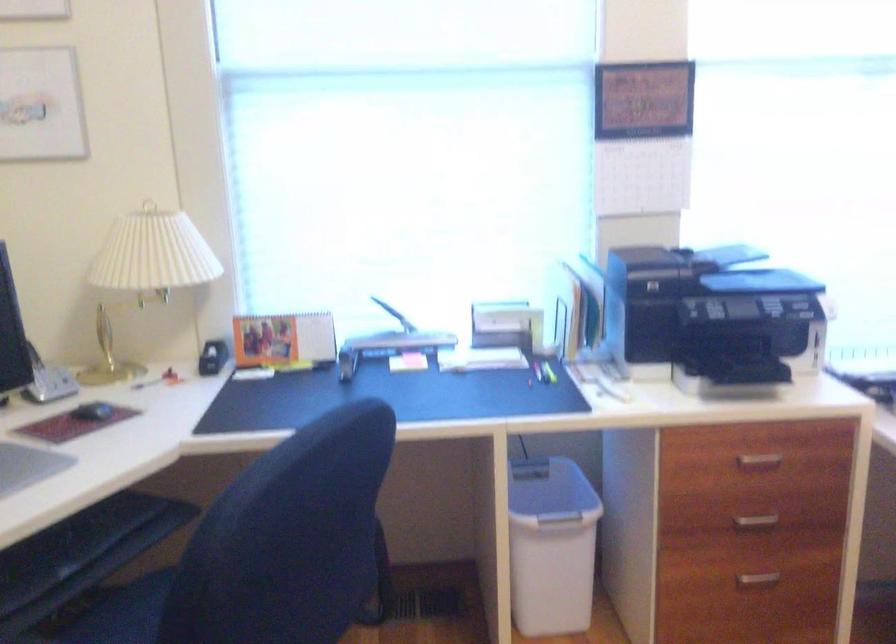
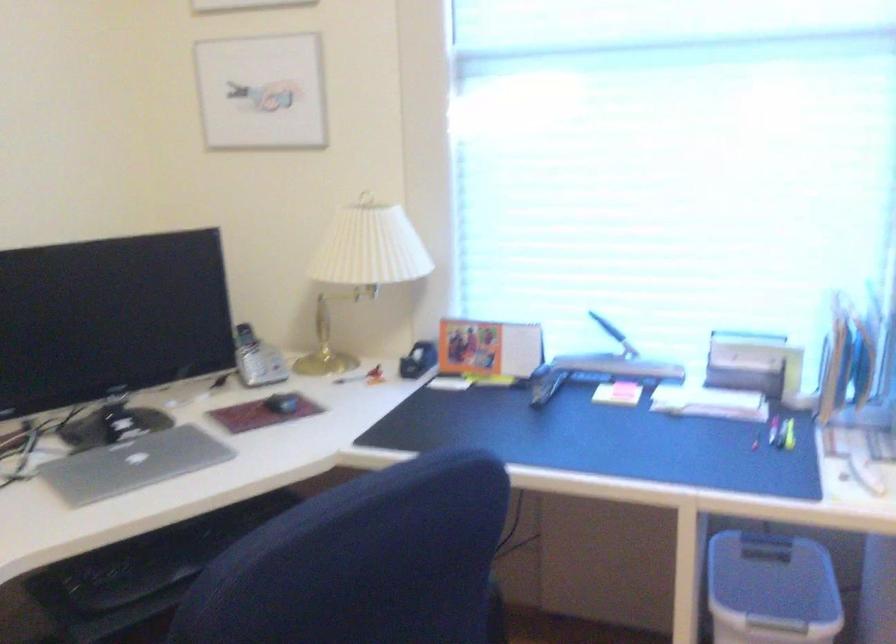
In a continuous first-person perspective shot, in which direction is the camera moving?

The movement direction of the cameraman is right, forward.